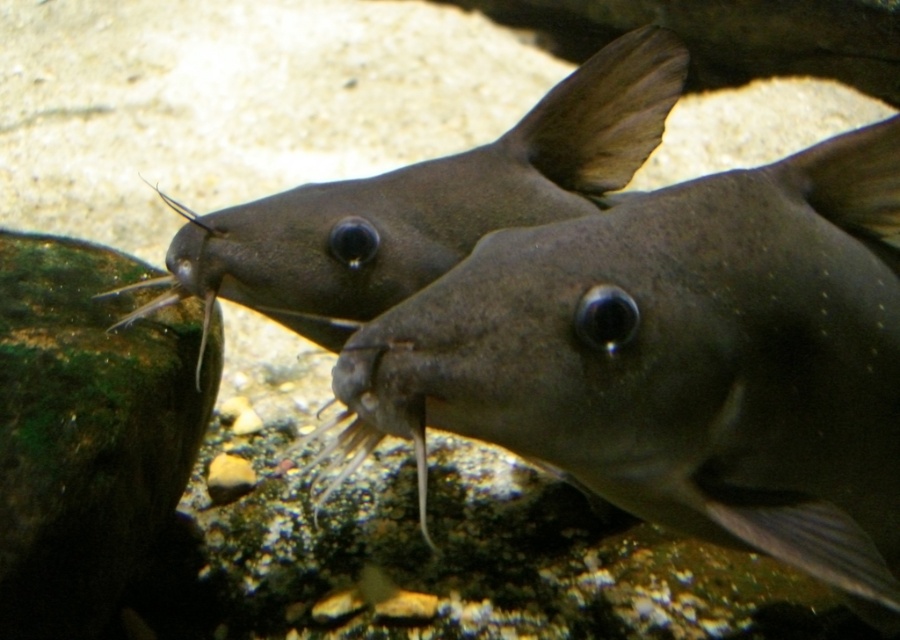
Question: From the image, what is the correct spatial relationship of smooth gray fish at center in relation to matte gray fish at center?

Choices:
 (A) below
 (B) above

Answer: (A)

Question: Which point is farther to the camera?

Choices:
 (A) smooth gray fish at center
 (B) matte gray fish at center

Answer: (B)

Question: Which point appears farthest from the camera in this image?

Choices:
 (A) (415, 253)
 (B) (894, 611)

Answer: (A)

Question: Is smooth gray fish at center below matte gray fish at center?

Choices:
 (A) no
 (B) yes

Answer: (B)

Question: Does smooth gray fish at center have a greater width compared to matte gray fish at center?

Choices:
 (A) no
 (B) yes

Answer: (A)

Question: Which object appears farthest from the camera in this image?

Choices:
 (A) smooth gray fish at center
 (B) matte gray fish at center

Answer: (B)